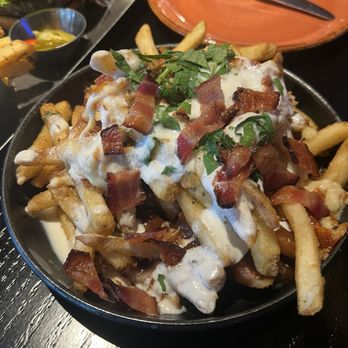
Image resolution: width=348 pixels, height=348 pixels. I want to click on orange plate, so click(269, 18).